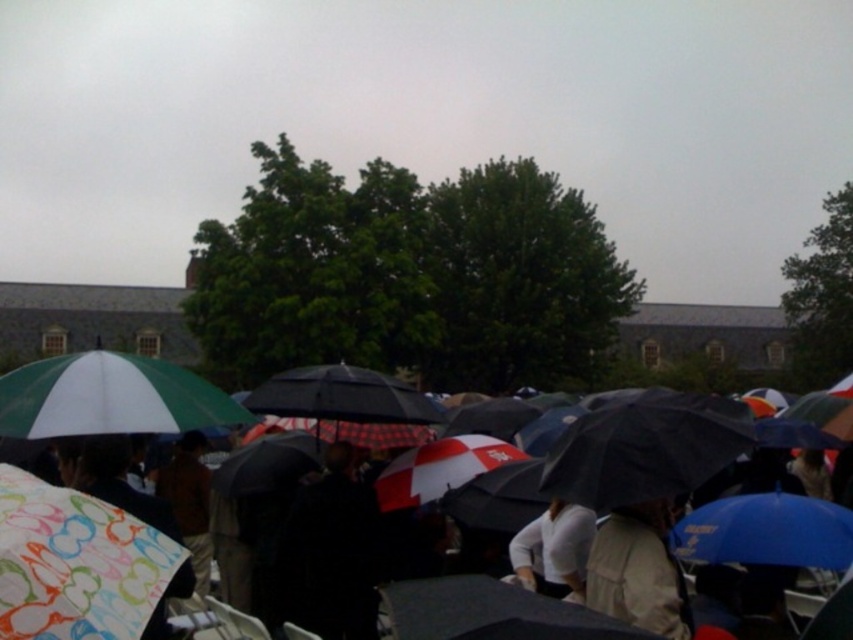
Question: Can you confirm if patterned fabric umbrella at lower left is positioned to the left of green matte umbrella at upper left?

Choices:
 (A) yes
 (B) no

Answer: (B)

Question: Which object is closer to the camera taking this photo?

Choices:
 (A) patterned fabric umbrella at lower left
 (B) green matte umbrella at upper left

Answer: (A)

Question: Does patterned fabric umbrella at lower left come in front of green matte umbrella at upper left?

Choices:
 (A) no
 (B) yes

Answer: (B)

Question: Can you confirm if patterned fabric umbrella at lower left is bigger than green matte umbrella at upper left?

Choices:
 (A) yes
 (B) no

Answer: (B)